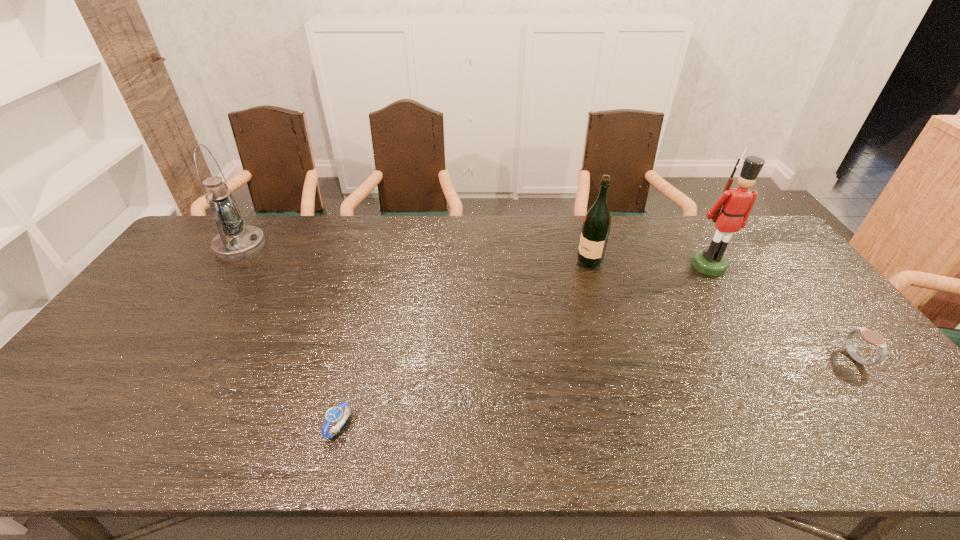
Locate an element on the screen. free spot located 0.350m on the front-facing side of the third object from left to right is located at coordinates (470, 262).

I want to click on vacant region located on the front-facing side of the third object from left to right, so click(525, 262).

Where is `vacant position located 0.310m on the front-facing side of the third object from left to right`? Image resolution: width=960 pixels, height=540 pixels. vacant position located 0.310m on the front-facing side of the third object from left to right is located at coordinates (483, 262).

Locate an element on the screen. This screenshot has height=540, width=960. free location located on the front of the second nearest object is located at coordinates (923, 441).

You are a GUI agent. You are given a task and a screenshot of the screen. Output one action in this format:
    pyautogui.click(x=<x>, y=<y>)
    Task: Click on the vacant space located 0.380m on the left of the left watch
    The height and width of the screenshot is (540, 960).
    Given the screenshot: What is the action you would take?
    pyautogui.click(x=160, y=427)

Identify the location of nutcracker positioned at the far edge. (738, 202).

Image resolution: width=960 pixels, height=540 pixels. Find the location of `oil lamp at the far edge`. oil lamp at the far edge is located at coordinates (236, 241).

Identify the location of liquor at the far edge. This screenshot has width=960, height=540. (596, 226).

Where is `object that is at the near edge`? Image resolution: width=960 pixels, height=540 pixels. object that is at the near edge is located at coordinates (335, 414).

I want to click on object situated at the left edge, so click(236, 241).